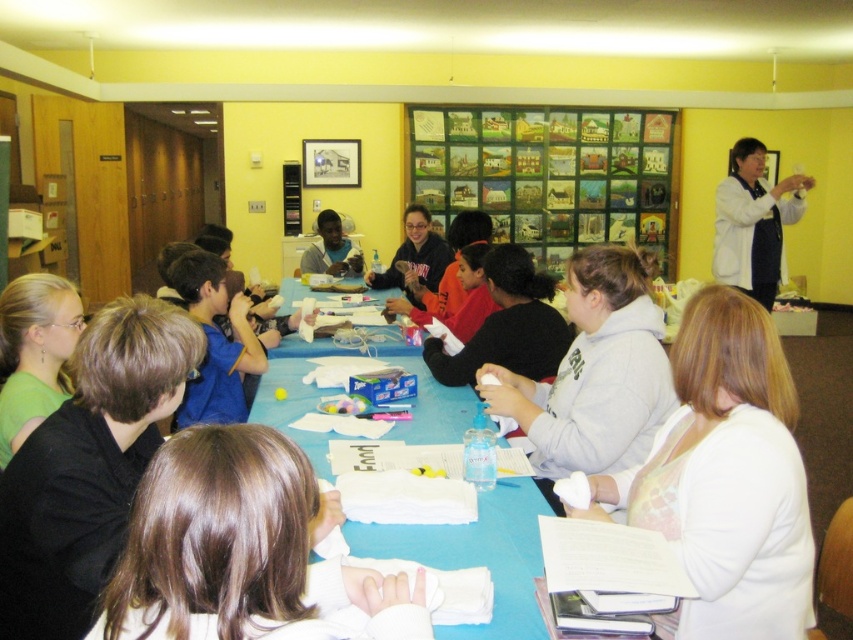
Question: Is the position of white matte shirt at lower right less distant than that of blue paper at center?

Choices:
 (A) yes
 (B) no

Answer: (A)

Question: Which of these objects is positioned closest to the wooden framed paintings at upper center?

Choices:
 (A) blue paper at center
 (B) white lab coat at upper right
 (C) brown hair at lower center

Answer: (B)

Question: Which point is closer to the camera taking this photo?

Choices:
 (A) (607, 177)
 (B) (762, 244)
 (C) (347, 256)

Answer: (B)

Question: Does blue paper at center appear on the left side of white lab coat at upper right?

Choices:
 (A) yes
 (B) no

Answer: (A)

Question: Is white lab coat at upper right above matte black shirt at center?

Choices:
 (A) yes
 (B) no

Answer: (A)

Question: Among these points, which one is farthest from the camera?

Choices:
 (A) (741, 573)
 (B) (753, 176)
 (C) (355, 588)

Answer: (B)